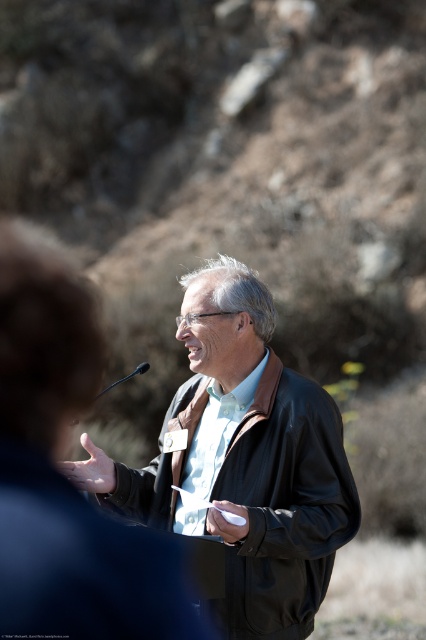
You are organizing a formal event and need to decide whether to place the black leather jacket at center and the black plastic microphone at center on a narrow shelf. Which item should you place first to ensure both fit on the shelf?

The black leather jacket at center is thinner than the black plastic microphone at center, so you should place the thicker black plastic microphone at center first to ensure both items fit on the narrow shelf.

Based on the photo, you are organizing an outdoor event and need to ensure that the black plastic microphone at center is visible to the audience. Given that the black leather jacket at center is much taller than the microphone, what could you do to improve the microphone visibility?

Since the black leather jacket at center is much taller than the black plastic microphone at center, you could raise the microphone stand to a higher position so that it stands above the jacket, ensuring better visibility for the audience.